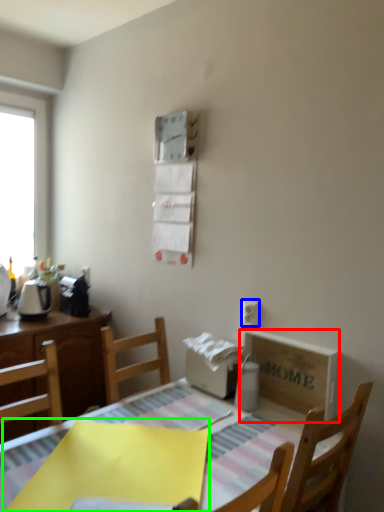
Question: Considering the real-world distances, which object is closest to cardboard box (highlighted by a red box)? electric outlet (highlighted by a blue box) or cloth (highlighted by a green box).

Choices:
 (A) electric outlet
 (B) cloth

Answer: (A)